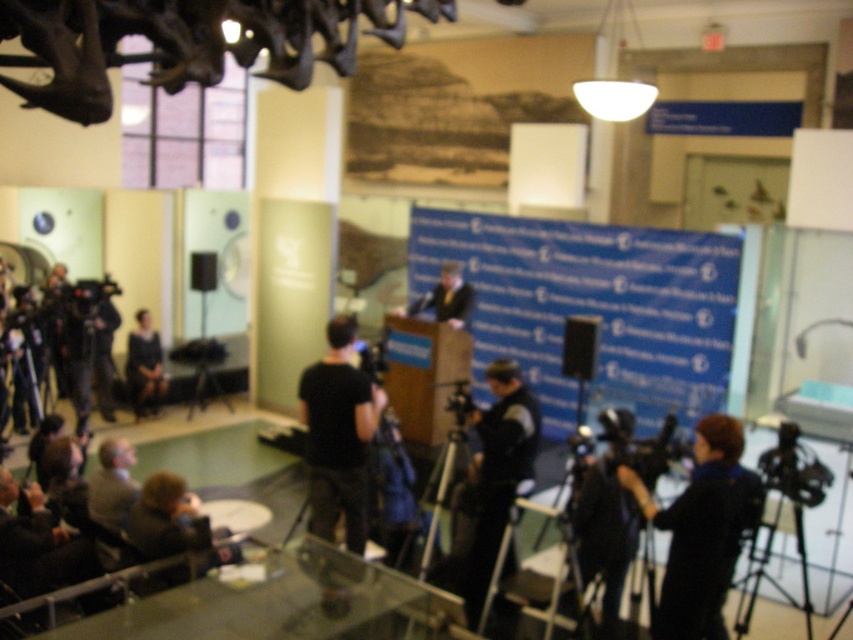
In the scene shown: You are a photographer at the event and want to take a photo of the dark fabric dress at center without the dark blue coat at lower right blocking it. What should you do?

Move to a position behind the dark blue coat at lower right so that the dark fabric dress at center is no longer blocked.